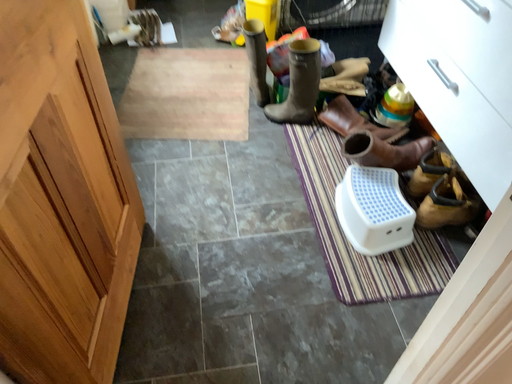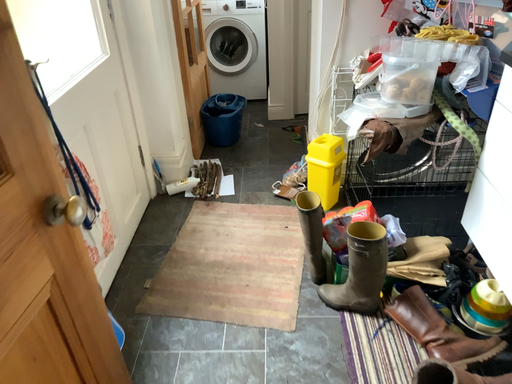
Question: Which way did the camera rotate in the video?

Choices:
 (A) rotated downward
 (B) rotated upward

Answer: (B)